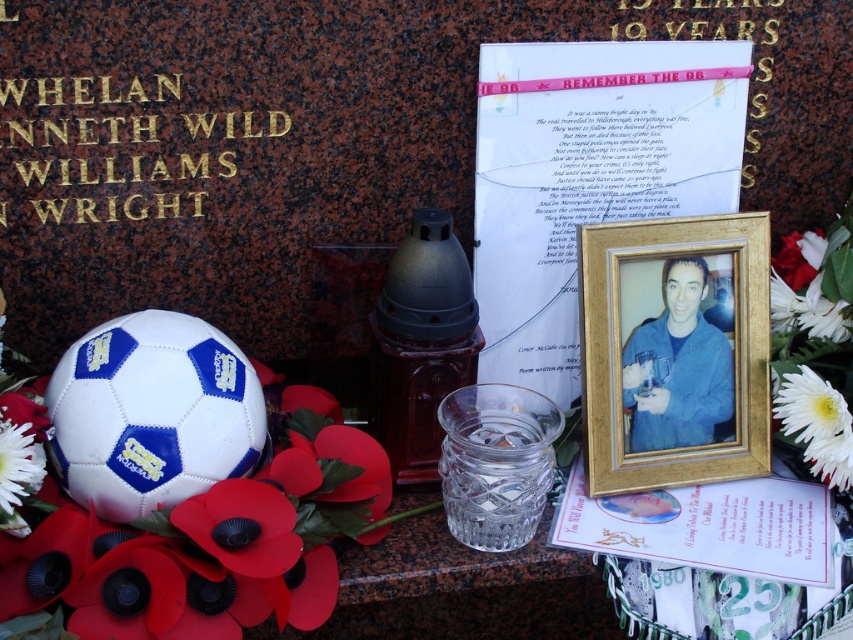
Is gold wooden photo frame at center thinner than blue denim jacket at center?

In fact, gold wooden photo frame at center might be wider than blue denim jacket at center.

Which is above, gold wooden photo frame at center or blue denim jacket at center?

blue denim jacket at center

This screenshot has width=853, height=640. Find the location of `gold wooden photo frame at center`. gold wooden photo frame at center is located at coordinates (674, 352).

Is silky fabric poppy at lower left positioned behind blue denim jacket at center?

No, silky fabric poppy at lower left is closer to the viewer.

Is point (67, 573) less distant than point (627, 385)?

Yes, it is in front of point (627, 385).

I want to click on silky fabric poppy at lower left, so click(212, 538).

Is point (285, 490) farther from viewer compared to point (625, 292)?

No, (285, 490) is in front of (625, 292).

Is silky fabric poppy at lower left shorter than gold wooden photo frame at center?

Yes, silky fabric poppy at lower left is shorter than gold wooden photo frame at center.

Who is more forward, (120, 532) or (769, 225)?

Point (120, 532) is more forward.

The width and height of the screenshot is (853, 640). What are the coordinates of `silky fabric poppy at lower left` in the screenshot? It's located at (212, 538).